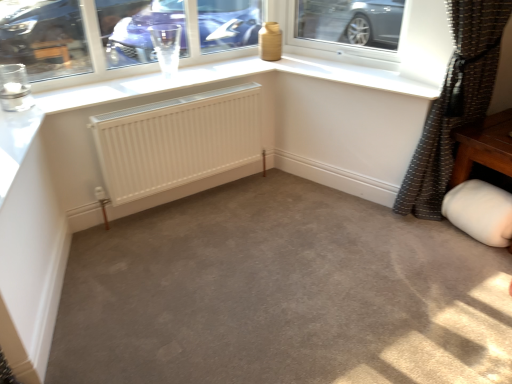
This screenshot has width=512, height=384. Find the location of `vacant space in between brown textured curtain at right and white matte radiator at center`. vacant space in between brown textured curtain at right and white matte radiator at center is located at coordinates (267, 216).